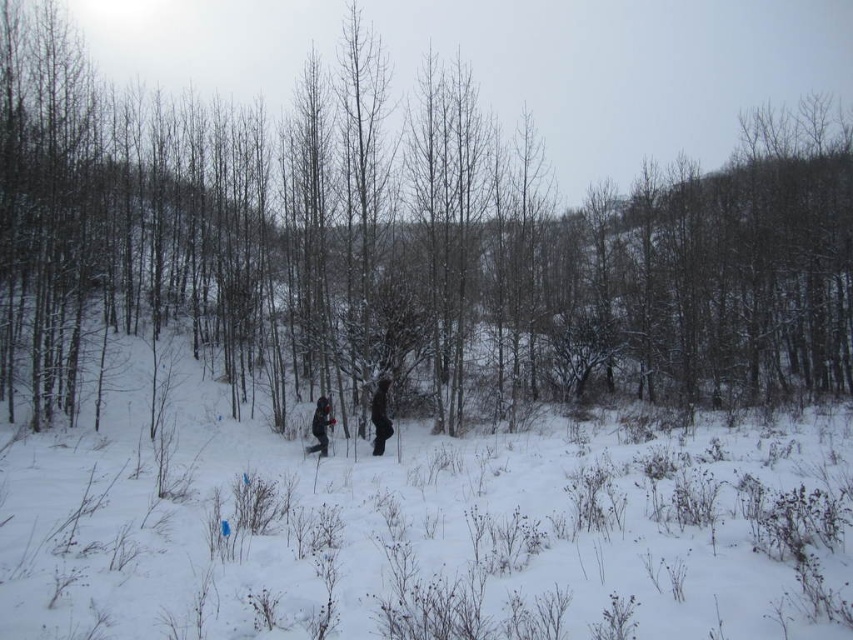
Who is higher up, white fluffy snow at center or dark gray fabric person at center?

dark gray fabric person at center

Who is more forward, (521, 492) or (389, 426)?

Point (521, 492) is more forward.

Does point (297, 513) lie in front of point (381, 428)?

Yes, point (297, 513) is closer to viewer.

At what (x,y) coordinates should I click in order to perform the action: click on white fluffy snow at center. Please return your answer as a coordinate pair (x, y). The height and width of the screenshot is (640, 853). Looking at the image, I should click on (426, 531).

Who is more distant from viewer, (x=375, y=404) or (x=318, y=404)?

The point (x=318, y=404) is more distant.

Between dark gray fabric couple at center and dark blue fabric jacket at center, which one appears on the right side from the viewer's perspective?

From the viewer's perspective, dark gray fabric couple at center appears more on the right side.

What are the coordinates of `dark gray fabric couple at center` in the screenshot? It's located at (380, 416).

Who is lower down, dark gray fabric person at center or dark blue fabric jacket at center?

dark blue fabric jacket at center is lower down.

Can you confirm if dark gray fabric person at center is positioned to the left of dark blue fabric jacket at center?

No, dark gray fabric person at center is not to the left of dark blue fabric jacket at center.

The image size is (853, 640). Describe the element at coordinates (380, 416) in the screenshot. I see `dark gray fabric person at center` at that location.

Where is `dark gray fabric person at center`? The width and height of the screenshot is (853, 640). dark gray fabric person at center is located at coordinates (380, 416).